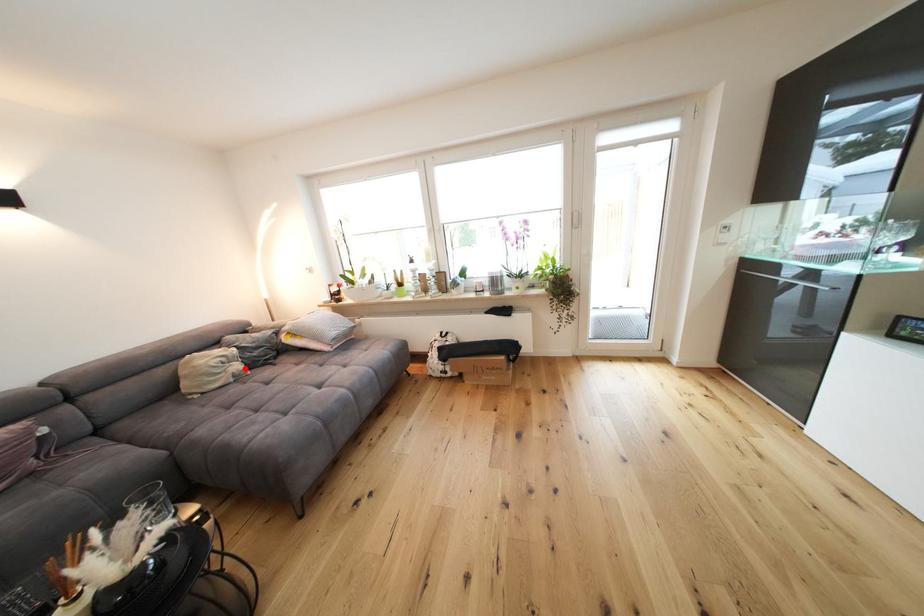
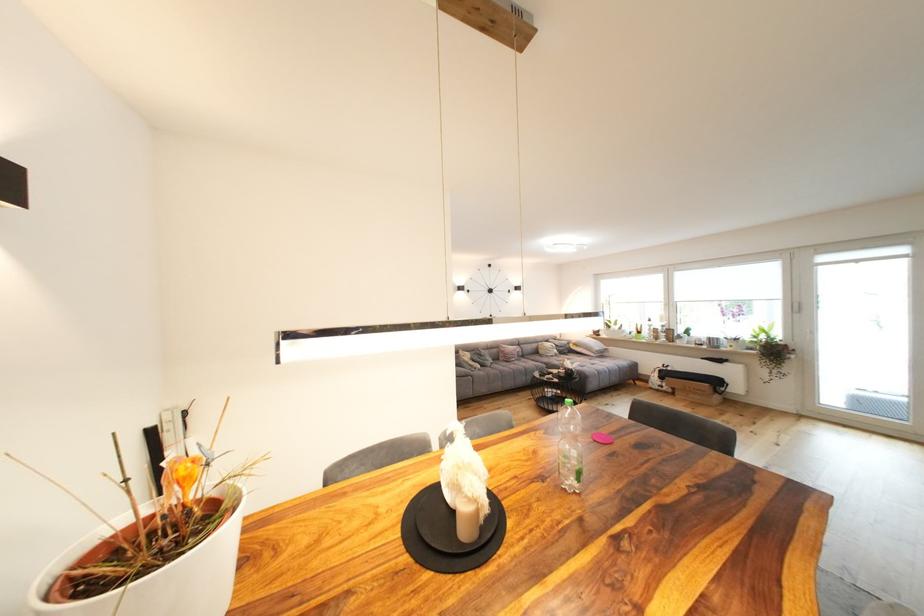
Where in the second image is the point corresponding to the highlighted location from the first image?

(563, 353)